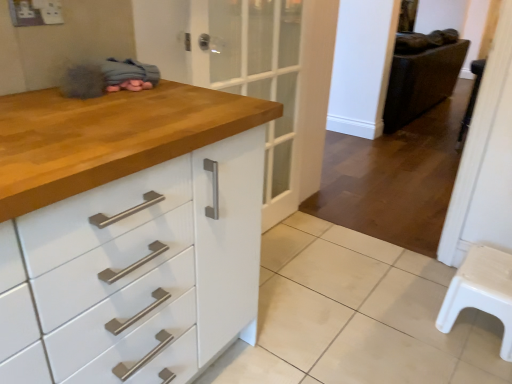
Question: Is white glossy tile at lower center bigger or smaller than white plastic stool at lower right?

Choices:
 (A) big
 (B) small

Answer: (A)

Question: Is point (468, 367) closer or farther from the camera than point (445, 316)?

Choices:
 (A) farther
 (B) closer

Answer: (B)

Question: Estimate the real-world distances between objects in this image. Which object is closer to the leather-like dark brown chair at right?

Choices:
 (A) white plastic step stool at right
 (B) white plastic stool at lower right
 (C) white glossy tile at lower center

Answer: (A)

Question: Estimate the real-world distances between objects in this image. Which object is closer to the white plastic stool at lower right?

Choices:
 (A) leather-like dark brown chair at right
 (B) white glossy tile at lower center
 (C) white plastic step stool at right

Answer: (B)